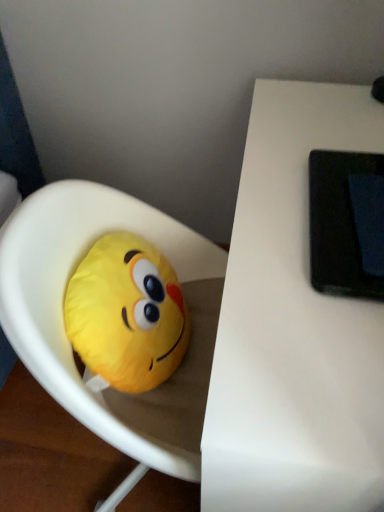
Where is `free space to the back side of black matte tablet at upper right`? free space to the back side of black matte tablet at upper right is located at coordinates (312, 136).